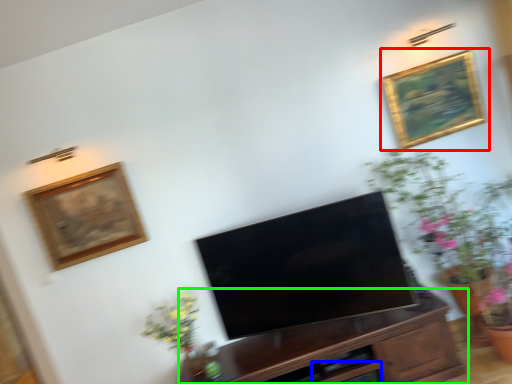
Question: Considering the real-world distances, which object is farthest from picture frame (highlighted by a red box)? drawer (highlighted by a blue box) or cabinetry (highlighted by a green box)?

Choices:
 (A) drawer
 (B) cabinetry

Answer: (A)